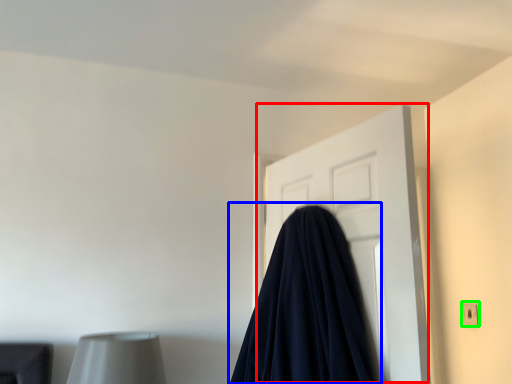
Question: Which is farther away from door (highlighted by a red box)? blanket (highlighted by a blue box) or electric outlet (highlighted by a green box)?

Choices:
 (A) blanket
 (B) electric outlet

Answer: (B)